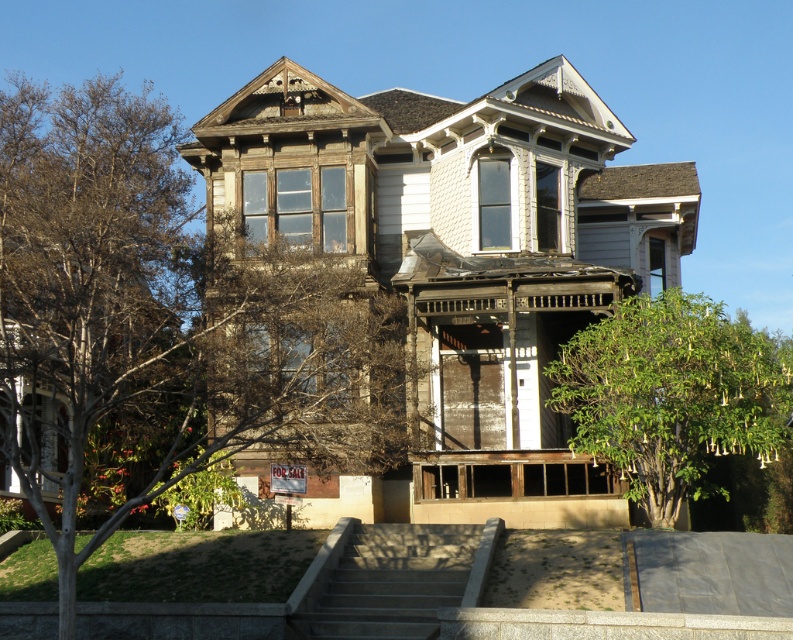
You are standing in front of the Victorian house and want to walk towards the gray concrete stairs at center. However, there is a green leafy tree at lower right in your path. Will you need to go around the tree to reach the stairs?

The green leafy tree at lower right is further to the viewer than gray concrete stairs at center, so the tree is closer to you. Therefore, you will need to go around the green leafy tree at lower right to reach the gray concrete stairs at center.

Based on the photo, you are standing in front of the Victorian house and want to plant a new tree exactly where the bare wood tree at center is currently located. What are the coordinates of the spot where you should plant the new tree?

The coordinates for planting the new tree should be at point (163, 324), as that is the 2D location of the bare wood tree at center.

You are standing in front of the Victorian house and notice two trees. The first is a bare wood tree at center, and the second is a green leafy tree at lower right. Which tree would block your view of the other tree if you were to stand directly in front of the house?

The bare wood tree at center is in front of the green leafy tree at lower right, so the bare wood tree at center would block your view of the green leafy tree at lower right.